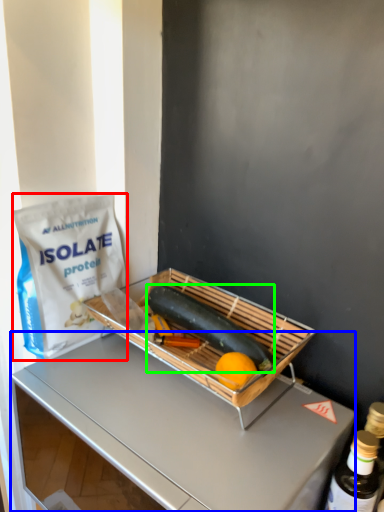
Question: Which is nearer to the grocery bag (highlighted by a red box)? desk (highlighted by a blue box) or green vegetables (highlighted by a green box).

Choices:
 (A) desk
 (B) green vegetables

Answer: (B)